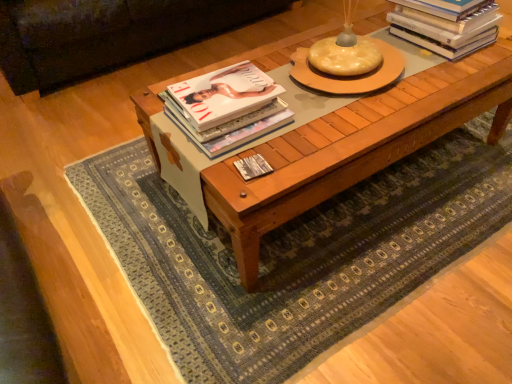
The image size is (512, 384). Identify the location of empty space that is ontop of wooden coffee table at center (from a real-world perspective). (338, 90).